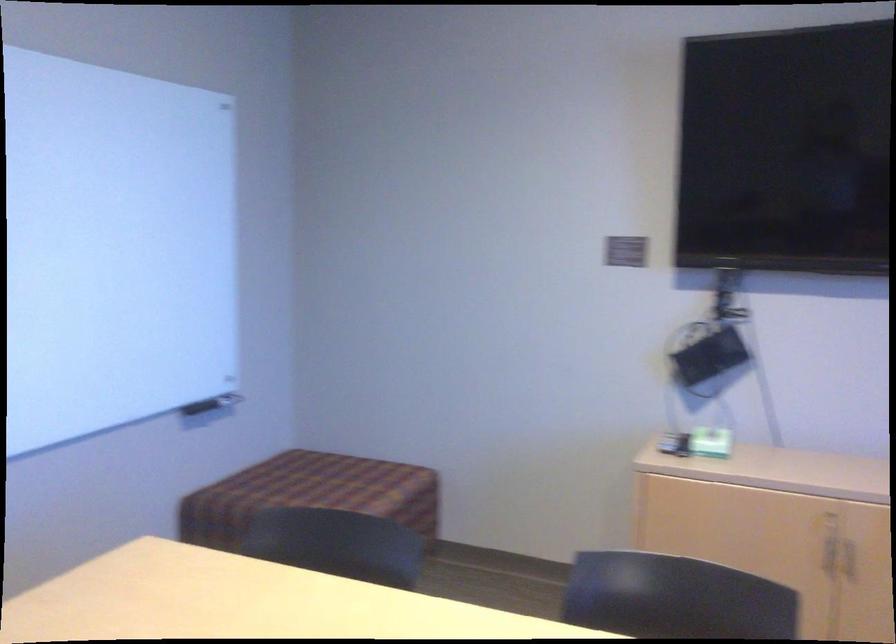
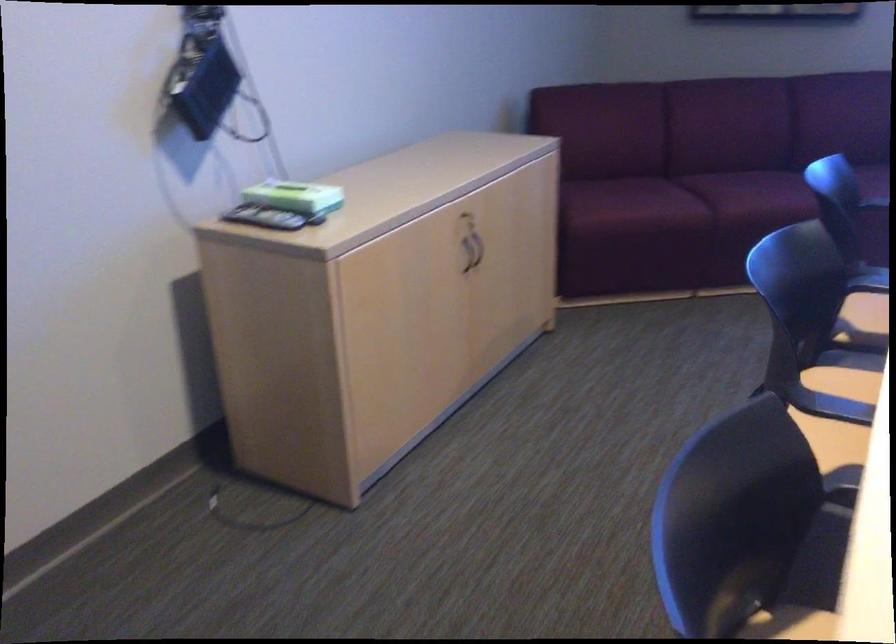
Locate, in the second image, the point that corresponds to point 661,440 in the first image.

(263, 218)